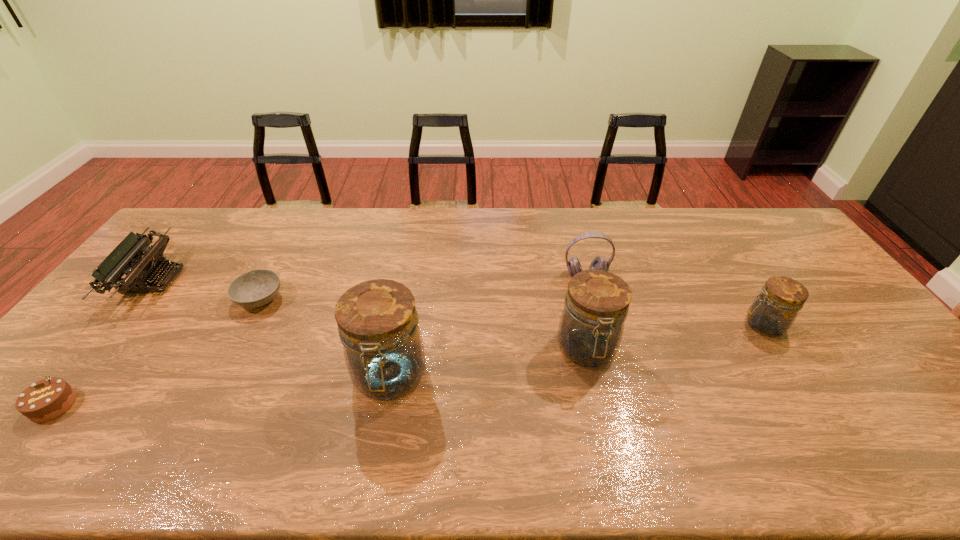
At what (x,y) coordinates should I click in order to perform the action: click on unoccupied area between the second tallest object and the chocolate cake. Please return your answer as a coordinate pair (x, y). This screenshot has height=540, width=960. Looking at the image, I should click on (320, 377).

Find the location of a particular element. vacant area between the headset and the chocolate cake is located at coordinates (320, 340).

Find the location of `vacant space in between the chocolate cake and the headset`. vacant space in between the chocolate cake and the headset is located at coordinates 320,340.

This screenshot has width=960, height=540. I want to click on free spot between the fifth tallest object and the chocolate cake, so click(x=103, y=343).

You are a GUI agent. You are given a task and a screenshot of the screen. Output one action in this format:
    pyautogui.click(x=<x>, y=<y>)
    Task: Click on the vacant area that lies between the leftmost jar and the bowl
    
    Given the screenshot: What is the action you would take?
    pyautogui.click(x=324, y=338)

Find the location of `free space between the third shortest object and the chocolate cake`. free space between the third shortest object and the chocolate cake is located at coordinates (103, 343).

I want to click on object that is the sixth closest to the second tallest jar, so coord(47,399).

I want to click on object that is the second closest to the second shortest object, so click(x=255, y=288).

Find the location of a particular element. The height and width of the screenshot is (540, 960). jar that can be found as the third closest to the headset is located at coordinates (378, 324).

Point out which jar is positioned as the second nearest to the chocolate cake. Please provide its 2D coordinates. Your answer should be formatted as a tuple, i.e. [(x, y)], where the tuple contains the x and y coordinates of a point satisfying the conditions above.

[(591, 325)]